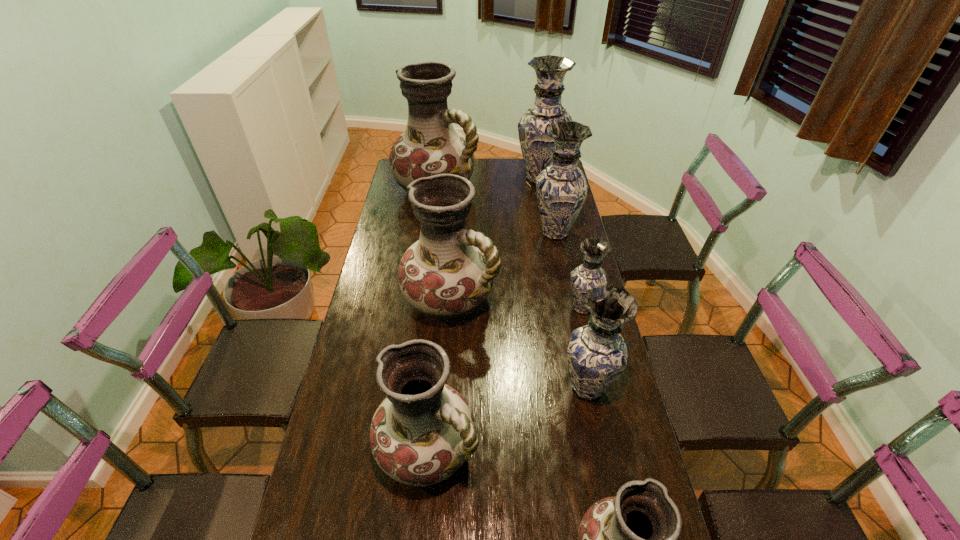
Point out which red vase is positioned as the second nearest to the third farthest blue vase. Please provide its 2D coordinates. Your answer should be formatted as a tuple, i.e. [(x, y)], where the tuple contains the x and y coordinates of a point satisfying the conditions above.

[(422, 432)]

Locate which blue vase ranks fourth in proximity to the nearest object. Please provide its 2D coordinates. Your answer should be formatted as a tuple, i.e. [(x, y)], where the tuple contains the x and y coordinates of a point satisfying the conditions above.

[(536, 145)]

At what (x,y) coordinates should I click in order to perform the action: click on the closest blue vase to the farthest red vase. Please return your answer as a coordinate pair (x, y). The height and width of the screenshot is (540, 960). Looking at the image, I should click on (536, 145).

This screenshot has height=540, width=960. In order to click on vacant space that satisfies the following two spatial constraints: 1. on the back side of the nearest blue vase; 2. on the left side of the second nearest blue vase in this screenshot , I will do `click(571, 308)`.